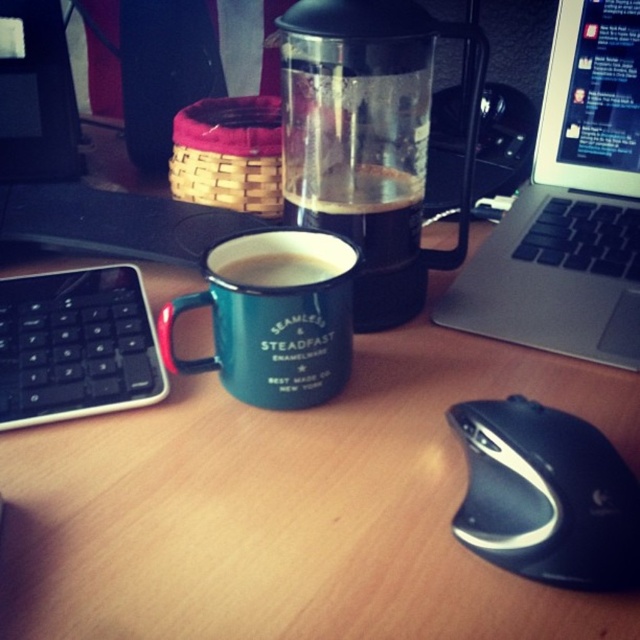
Question: Is black rubberized mouse at lower right positioned behind matte enamel mug at center?

Choices:
 (A) yes
 (B) no

Answer: (B)

Question: Is the position of silver metallic laptop at upper right less distant than that of teal enamel mug at center?

Choices:
 (A) yes
 (B) no

Answer: (B)

Question: Which point is farther from the camera taking this photo?

Choices:
 (A) (278, 276)
 (B) (513, 572)
 (C) (541, 177)

Answer: (C)

Question: Among these points, which one is farthest from the camera?

Choices:
 (A) (51, 358)
 (B) (419, 284)

Answer: (B)

Question: Which of the following is the closest to the observer?

Choices:
 (A) (358, 156)
 (B) (340, 269)
 (C) (136, 340)

Answer: (B)

Question: Is black plastic keyboard at left closer to the viewer compared to matte enamel mug at center?

Choices:
 (A) no
 (B) yes

Answer: (A)